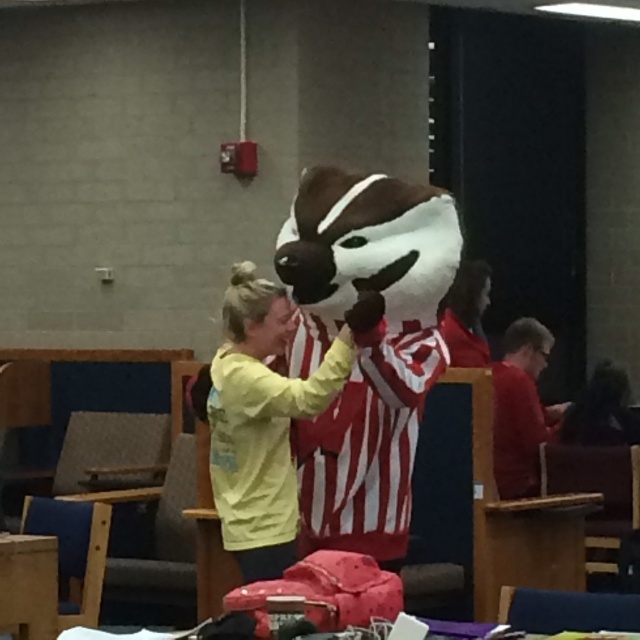
Who is lower down, yellow cotton shirt at center or smooth red shirt at center?

yellow cotton shirt at center

Looking at this image, does yellow cotton shirt at center have a smaller size compared to smooth red shirt at center?

Incorrect, yellow cotton shirt at center is not smaller in size than smooth red shirt at center.

At what (x,y) coordinates should I click in order to perform the action: click on yellow cotton shirt at center. Please return your answer as a coordinate pair (x, y). The width and height of the screenshot is (640, 640). Looking at the image, I should click on click(262, 419).

Is yellow cotton shirt at center closer to the viewer compared to red matte shirt at right?

Yes, yellow cotton shirt at center is in front of red matte shirt at right.

Who is taller, yellow cotton shirt at center or red matte shirt at right?

Standing taller between the two is yellow cotton shirt at center.

Who is more distant from viewer, (x=288, y=556) or (x=506, y=388)?

The point (x=506, y=388) is behind.

This screenshot has width=640, height=640. Identify the location of yellow cotton shirt at center. (262, 419).

Between red matte shirt at right and smooth red shirt at center, which one has less height?

smooth red shirt at center is shorter.

Between point (538, 486) and point (486, 358), which one is positioned behind?

Positioned behind is point (486, 358).

Is point (515, 481) farther from viewer compared to point (460, 291)?

No, it is not.

I want to click on red matte shirt at right, so click(522, 408).